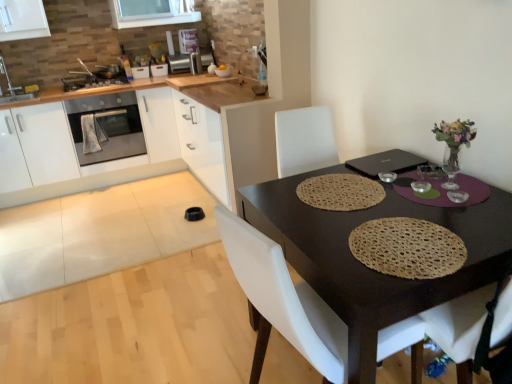
Question: From their relative heights in the image, would you say satin silver toaster at upper center, marked as the first appliance in a right-to-left arrangement, is taller or shorter than matte stainless steel oven at left?

Choices:
 (A) short
 (B) tall

Answer: (A)

Question: Looking at the image, does satin silver toaster at upper center, marked as the first appliance in a right-to-left arrangement, seem bigger or smaller compared to matte stainless steel oven at left?

Choices:
 (A) big
 (B) small

Answer: (B)

Question: Which object is positioned closest to the brown woven placemat at center?

Choices:
 (A) wooden countertop at upper left
 (B) white glossy sink at upper left
 (C) woven beige placemat at table center
 (D) satin silver toaster at upper center, the fourth appliance positioned from the left
 (E) satin silver toaster at upper center, placed as the 3th appliance when sorted from left to right

Answer: (C)

Question: Which object is the closest to the satin silver toaster at upper center, which is counted as the second appliance, starting from the right?

Choices:
 (A) metallic silver toaster at upper left, the 3th appliance in the right-to-left sequence
 (B) matte stainless steel oven at left
 (C) woven beige placemat at table center
 (D) wooden countertop at upper left
 (E) wooden countertop at upper center

Answer: (A)